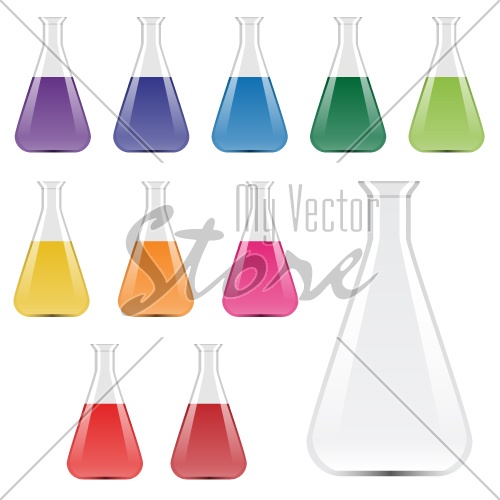
Locate an element on the screen. The width and height of the screenshot is (500, 500). glass is located at coordinates (387, 311).